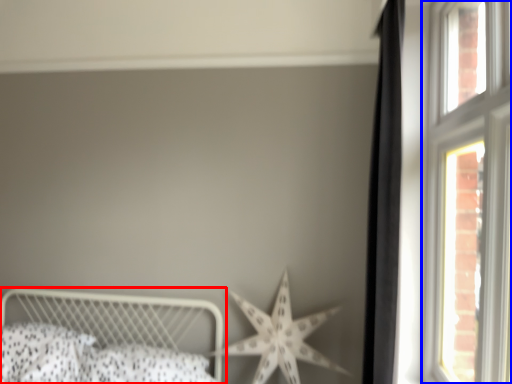
Question: Among these objects, which one is nearest to the camera, bed (highlighted by a red box) or window (highlighted by a blue box)?

Choices:
 (A) bed
 (B) window

Answer: (B)